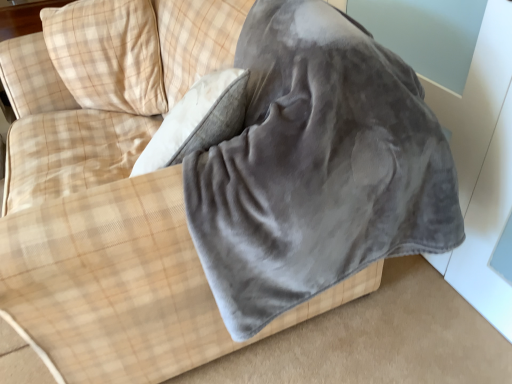
What is the approximate width of gray fleece blanket at center?

The width of gray fleece blanket at center is 27.91 inches.

What do you see at coordinates (317, 167) in the screenshot? I see `gray fleece blanket at center` at bounding box center [317, 167].

Identify the location of gray fleece blanket at center. This screenshot has width=512, height=384. (317, 167).

Measure the distance between gray fleece blanket at center and camera.

They are 30.98 inches apart.

Measure the distance between point (329, 8) and camera.

A distance of 37.95 inches exists between point (329, 8) and camera.

Find the location of a particular element. The width and height of the screenshot is (512, 384). beige plaid pillow at upper left is located at coordinates (108, 54).

What do you see at coordinates (108, 54) in the screenshot? I see `beige plaid pillow at upper left` at bounding box center [108, 54].

Where is `gray fleece blanket at center`? The width and height of the screenshot is (512, 384). gray fleece blanket at center is located at coordinates pyautogui.click(x=317, y=167).

Can you confirm if gray fleece blanket at center is positioned to the right of beige plaid pillow at upper left?

Yes.

Is gray fleece blanket at center in front of beige plaid pillow at upper left?

Yes, the depth of gray fleece blanket at center is less than that of beige plaid pillow at upper left.

Considering the positions of points (193, 237) and (106, 109), is point (193, 237) closer to camera compared to point (106, 109)?

Yes, point (193, 237) is closer to viewer.

From the image's perspective, which is above, gray fleece blanket at center or beige plaid pillow at upper left?

From the image's view, beige plaid pillow at upper left is above.

From a real-world perspective, who is located lower, gray fleece blanket at center or beige plaid pillow at upper left?

In real-world perspective, gray fleece blanket at center is lower.

Considering the sizes of objects gray fleece blanket at center and beige plaid pillow at upper left in the image provided, who is thinner, gray fleece blanket at center or beige plaid pillow at upper left?

Thinner between the two is beige plaid pillow at upper left.

Between gray fleece blanket at center and beige plaid pillow at upper left, which one has more height?

gray fleece blanket at center.

Does gray fleece blanket at center have a larger size compared to beige plaid pillow at upper left?

Yes.

Is gray fleece blanket at center not inside beige plaid pillow at upper left?

Yes, gray fleece blanket at center is not within beige plaid pillow at upper left.

Does gray fleece blanket at center touch beige plaid pillow at upper left?

They are not placed beside each other.

Is gray fleece blanket at center oriented away from beige plaid pillow at upper left?

No.

How many degrees apart are the facing directions of gray fleece blanket at center and beige plaid pillow at upper left?

The angular difference between gray fleece blanket at center and beige plaid pillow at upper left is 52.4 degrees.

Identify the location of sleeping bag on the right of beige plaid pillow at upper left. This screenshot has width=512, height=384. (317, 167).

Does beige plaid pillow at upper left appear on the left side of gray fleece blanket at center?

Correct, you'll find beige plaid pillow at upper left to the left of gray fleece blanket at center.

Is the depth of beige plaid pillow at upper left greater than that of gray fleece blanket at center?

Yes, it is.

Considering the points (78, 22) and (282, 224), which point is behind, point (78, 22) or point (282, 224)?

The point (78, 22) is behind.

From the image's perspective, is beige plaid pillow at upper left over gray fleece blanket at center?

Correct, beige plaid pillow at upper left appears higher than gray fleece blanket at center in the image.

From a real-world perspective, is beige plaid pillow at upper left below gray fleece blanket at center?

No, from a real-world perspective, beige plaid pillow at upper left is not below gray fleece blanket at center.

Between beige plaid pillow at upper left and gray fleece blanket at center, which one has larger width?

With larger width is gray fleece blanket at center.

Does beige plaid pillow at upper left have a lesser height compared to gray fleece blanket at center?

Yes.

Looking at the image, does beige plaid pillow at upper left seem bigger or smaller compared to gray fleece blanket at center?

beige plaid pillow at upper left is smaller than gray fleece blanket at center.

Would you say beige plaid pillow at upper left is inside or outside gray fleece blanket at center?

beige plaid pillow at upper left is not enclosed by gray fleece blanket at center.

Is there a large distance between beige plaid pillow at upper left and gray fleece blanket at center?

No, beige plaid pillow at upper left is not far from gray fleece blanket at center.

Is beige plaid pillow at upper left turned away from gray fleece blanket at center?

No, beige plaid pillow at upper left is not facing away from gray fleece blanket at center.

What's the angular difference between beige plaid pillow at upper left and gray fleece blanket at center's facing directions?

The angular difference between beige plaid pillow at upper left and gray fleece blanket at center is 52.4 degrees.

Find the location of `pillow located above the gray fleece blanket at center (from a real-world perspective)`. pillow located above the gray fleece blanket at center (from a real-world perspective) is located at coordinates (108, 54).

Locate an element on the screen. sleeping bag that appears below the beige plaid pillow at upper left (from a real-world perspective) is located at coordinates (317, 167).

At what (x,y) coordinates should I click in order to perform the action: click on sleeping bag that appears below the beige plaid pillow at upper left (from the image's perspective). Please return your answer as a coordinate pair (x, y). The image size is (512, 384). Looking at the image, I should click on (317, 167).